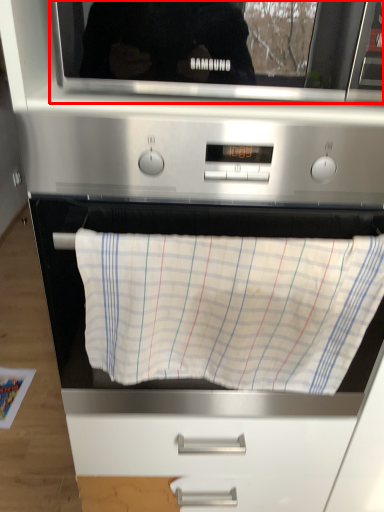
Question: In this image, where is microwave oven (annotated by the red box) located relative to blanket?

Choices:
 (A) left
 (B) right

Answer: (B)